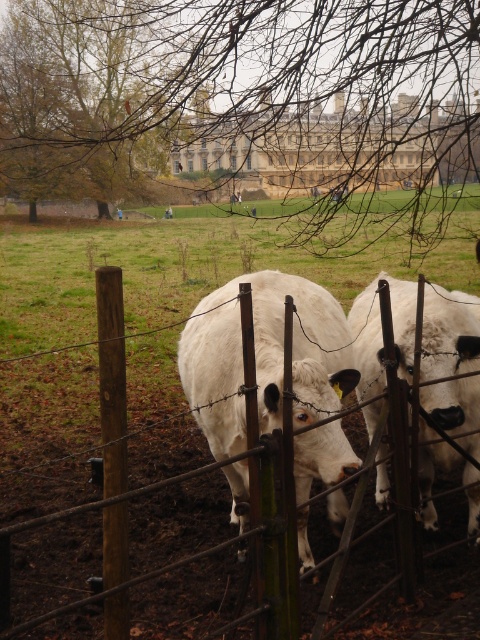
You are a farmer who needs to measure the distance between the two white cows in the scene. According to the image, how far apart are the white matte cow at center and the other cow?

The two cows are 10.97 feet apart.

You are a bird looking for a perch. You see the bare branches at upper center and the brown wooden fence at center. Which one is taller?

The bare branches at upper center are taller than the brown wooden fence at center.

You are a photographer wanting to capture the brown leafy tree at upper left and the brown wooden fence at center in a single frame. Based on the scene, can you determine which object is positioned higher in the image?

The brown leafy tree at upper left is located above the brown wooden fence at center, so it is positioned higher in the image.